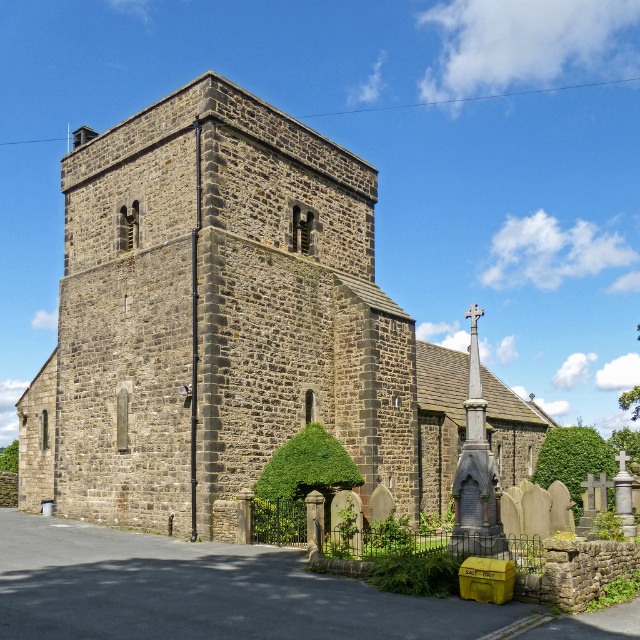
Question: Is rustic stone church at center wider than green leafy hedge at center?

Choices:
 (A) yes
 (B) no

Answer: (A)

Question: Does rustic stone church at center appear under green leafy hedge at center?

Choices:
 (A) no
 (B) yes

Answer: (A)

Question: From the image, what is the correct spatial relationship of green leafy hedge at center in relation to green leafy hedge at lower right?

Choices:
 (A) right
 (B) left

Answer: (B)

Question: Which of the following is the closest to the observer?

Choices:
 (A) (248, 196)
 (B) (616, 467)

Answer: (A)

Question: Which point appears closest to the camera in this image?

Choices:
 (A) (579, 506)
 (B) (298, 536)
 (C) (243, 353)

Answer: (B)

Question: Which object appears closest to the camera in this image?

Choices:
 (A) rustic stone church at center
 (B) green leafy hedge at lower right
 (C) green leafy hedge at center

Answer: (A)